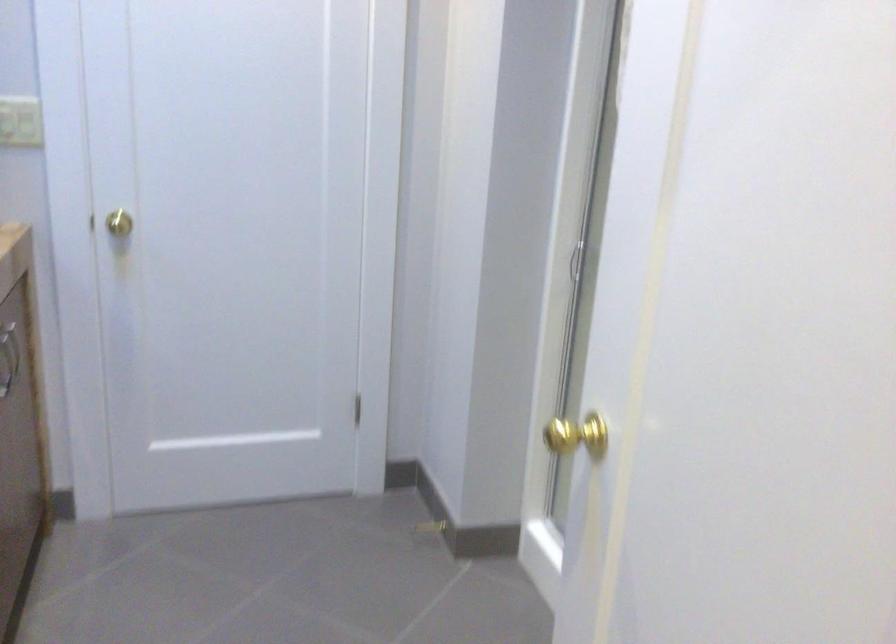
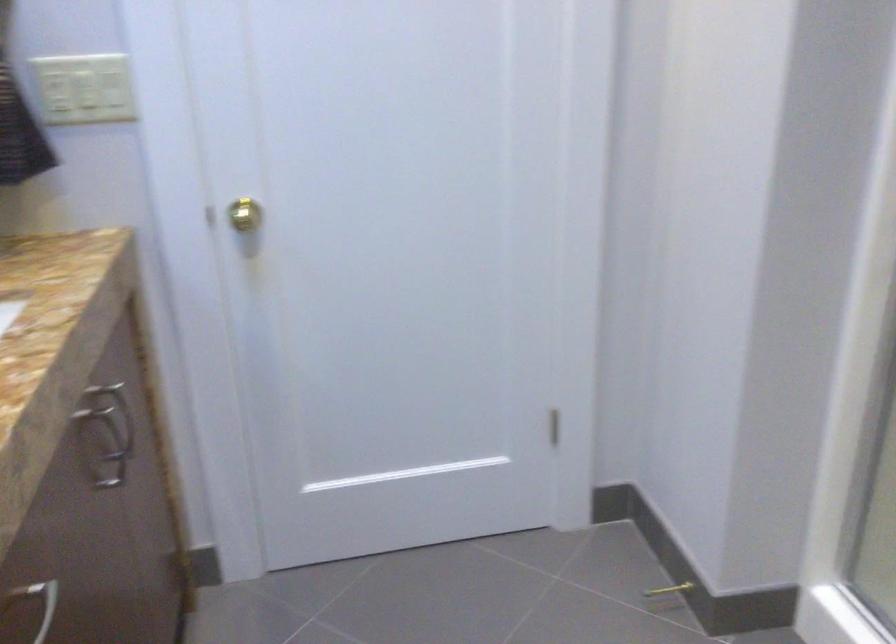
Locate, in the second image, the point that corresponds to pixel 433 538 in the first image.

(666, 596)